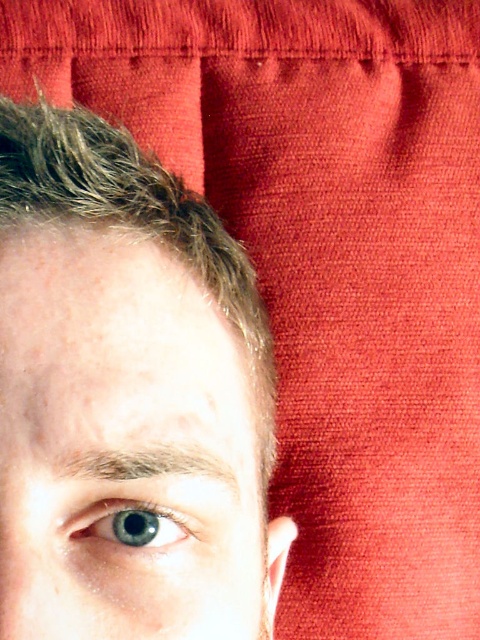
You are an artist trying to paint the scene. You need to decide the order of painting the blue matte eye at center and the blue glossy eye at center. Which one should you paint first to ensure proper layering?

The blue matte eye at center should be painted first because it is in front of the blue glossy eye at center, allowing the glossy eye to be layered underneath appropriately.

You are an artist trying to paint the two eyes in the image. You notice that the blue matte eye at center and the blue glossy eye at center have different widths. Which one should you paint first if you want to start with the wider one?

The blue matte eye at center has a greater width than the blue glossy eye at center, so you should paint the blue matte eye at center first.